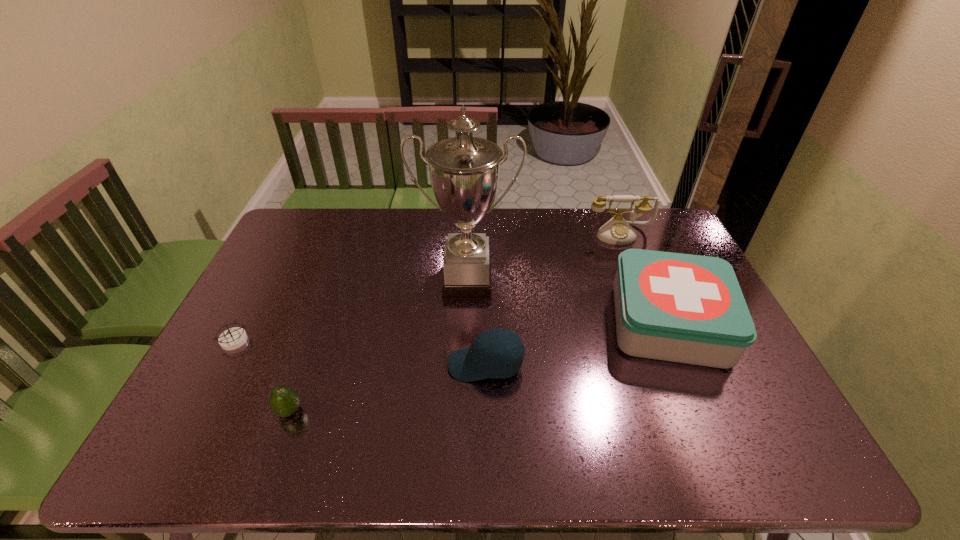
Find the location of `the tallest object`. the tallest object is located at coordinates (464, 171).

I want to click on the farthest object, so click(x=617, y=231).

The width and height of the screenshot is (960, 540). What are the coordinates of `the first-aid kit` in the screenshot? It's located at (684, 308).

Where is `baseball cap`? baseball cap is located at coordinates (481, 360).

This screenshot has width=960, height=540. I want to click on the fifth object from right to left, so pyautogui.click(x=284, y=401).

Locate an element on the screen. the fifth tallest object is located at coordinates (284, 401).

This screenshot has width=960, height=540. Identify the location of compass. (233, 338).

Where is `the leftmost object`? the leftmost object is located at coordinates (233, 338).

Where is `vacant space located 0.390m at the front view of the trophy cup`? The height and width of the screenshot is (540, 960). vacant space located 0.390m at the front view of the trophy cup is located at coordinates (463, 422).

The image size is (960, 540). In order to click on vacant position located on the dial of the farthest object in this screenshot , I will do (x=634, y=269).